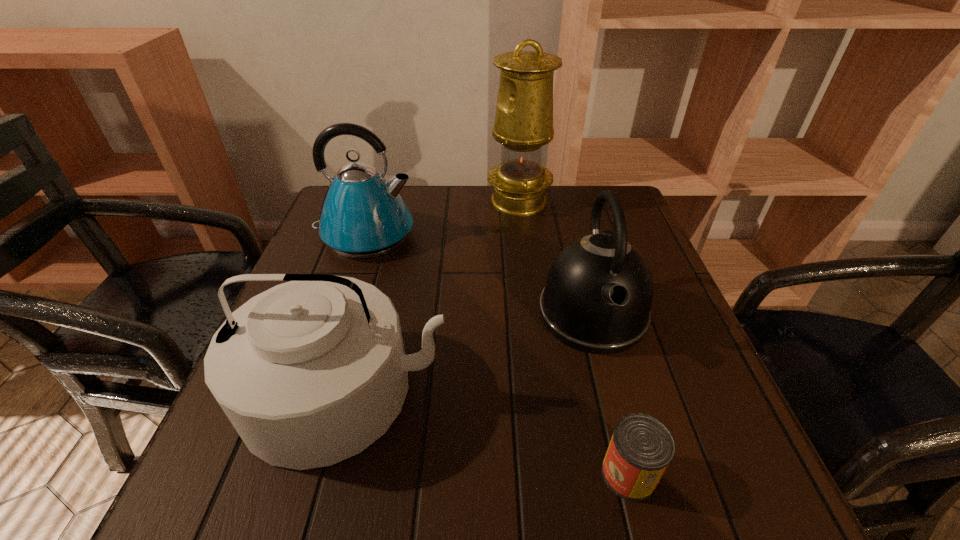
The height and width of the screenshot is (540, 960). Identify the location of vacant area at the right edge of the desktop. (628, 383).

In the image, there is a desktop. At what (x,y) coordinates should I click in order to perform the action: click on free region at the near left corner. Please return your answer as a coordinate pair (x, y). The width and height of the screenshot is (960, 540). Looking at the image, I should click on (293, 472).

You are a GUI agent. You are given a task and a screenshot of the screen. Output one action in this format:
    pyautogui.click(x=<x>, y=<y>)
    Task: Click on the free space between the rightmost kettle and the oil lamp
    The image size is (960, 540).
    Given the screenshot: What is the action you would take?
    pyautogui.click(x=556, y=258)

This screenshot has width=960, height=540. Find the location of `unoccupied area between the farthest kettle and the can`. unoccupied area between the farthest kettle and the can is located at coordinates (497, 354).

At what (x,y) coordinates should I click in order to perform the action: click on vacant point located between the farthest kettle and the tallest object. Please return your answer as a coordinate pair (x, y). The height and width of the screenshot is (540, 960). Looking at the image, I should click on (442, 218).

The width and height of the screenshot is (960, 540). Identify the location of free point between the oil lamp and the rightmost kettle. (556, 258).

At what (x,y) coordinates should I click in order to perform the action: click on free space that is in between the tallest object and the farthest kettle. Please return your answer as a coordinate pair (x, y). Image resolution: width=960 pixels, height=540 pixels. Looking at the image, I should click on (442, 218).

Image resolution: width=960 pixels, height=540 pixels. Identify the location of vacant space that's between the rightmost kettle and the oil lamp. 556,258.

This screenshot has width=960, height=540. Identify the location of vacant space that is in between the can and the farthest kettle. (497, 354).

Find the location of a particular element. vacant area that lies between the rightmost kettle and the farthest kettle is located at coordinates (479, 274).